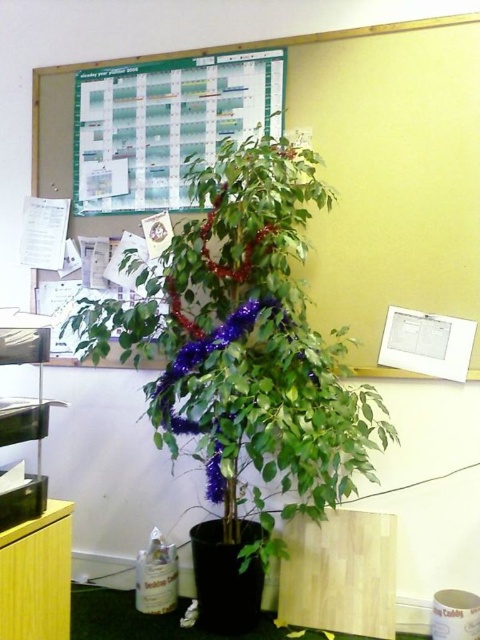
Is green glossy plant at center positioned at the back of yellow wood cabinet at lower left?

That is True.

Is point (235, 502) behind point (36, 632)?

Yes, point (235, 502) is farther from viewer.

Does point (322, 198) come in front of point (13, 630)?

No, (322, 198) is further to viewer.

Where is `green glossy plant at center`? green glossy plant at center is located at coordinates (245, 344).

Is green matte bulletin board at upper center to the left of green paper at upper center from the viewer's perspective?

Yes, green matte bulletin board at upper center is to the left of green paper at upper center.

Can you confirm if green matte bulletin board at upper center is bigger than green paper at upper center?

Indeed, green matte bulletin board at upper center has a larger size compared to green paper at upper center.

Between point (93, 67) and point (204, 67), which one is positioned behind?

The point (93, 67) is more distant.

This screenshot has height=640, width=480. I want to click on green matte bulletin board at upper center, so click(149, 125).

I want to click on green glossy plant at center, so click(245, 344).

Is green glossy plant at center wider than green matte bulletin board at upper center?

Indeed, green glossy plant at center has a greater width compared to green matte bulletin board at upper center.

Does point (300, 419) come behind point (175, 92)?

No.

What are the coordinates of `green glossy plant at center` in the screenshot? It's located at (245, 344).